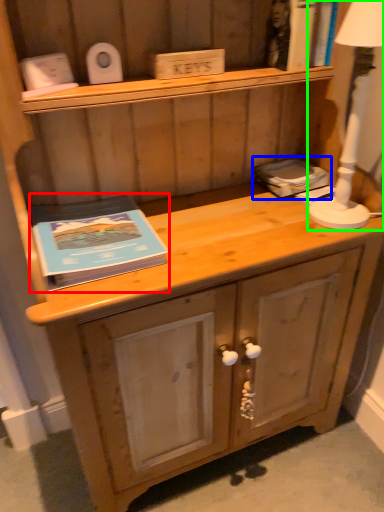
Question: Which is nearer to the paperback book (highlighted by a red box)? book (highlighted by a blue box) or bedside lamp (highlighted by a green box).

Choices:
 (A) book
 (B) bedside lamp

Answer: (A)